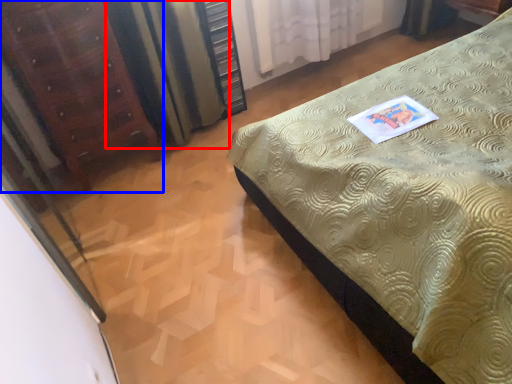
Question: Among these objects, which one is farthest to the camera, curtain (highlighted by a red box) or furniture (highlighted by a blue box)?

Choices:
 (A) curtain
 (B) furniture

Answer: (A)